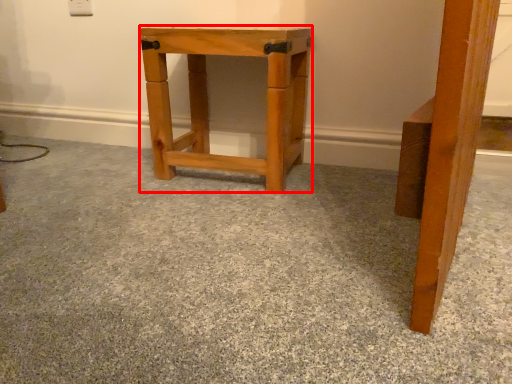
Question: From the image's perspective, where is stool (annotated by the red box) located relative to concrete?

Choices:
 (A) below
 (B) above

Answer: (B)